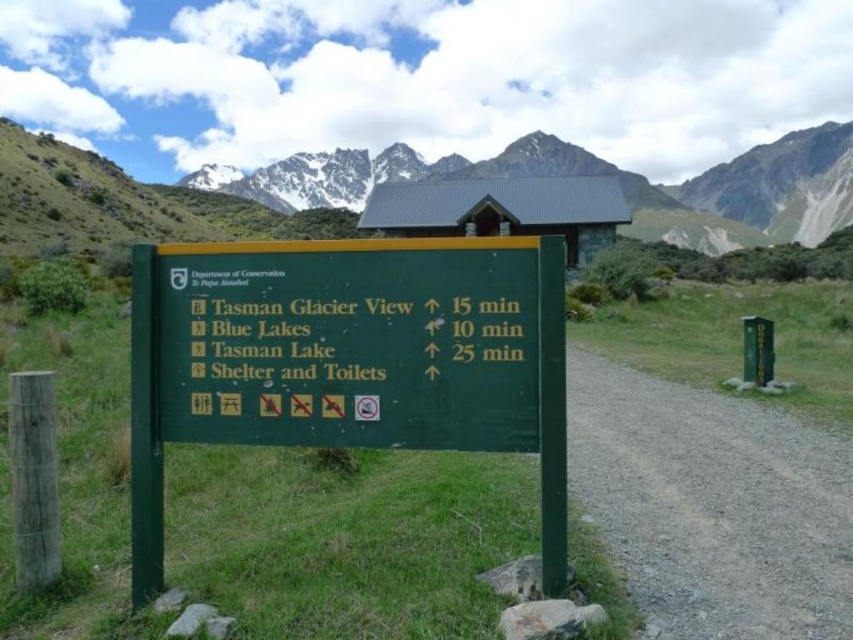
Between point (149, 412) and point (666, 211), which one is positioned in front?

Point (149, 412)

This screenshot has height=640, width=853. I want to click on green matte sign at center, so click(x=347, y=358).